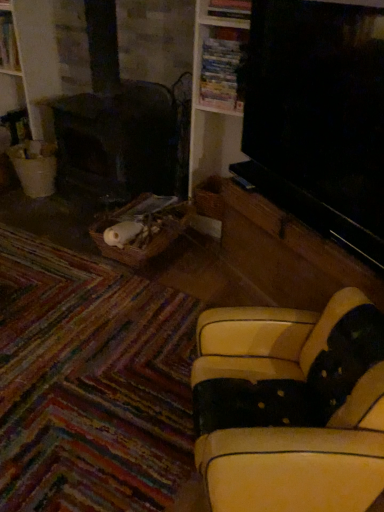
Find the location of `empty space that is ontop of wooden bookshelf at upper center (from a real-world perspective)`. empty space that is ontop of wooden bookshelf at upper center (from a real-world perspective) is located at coordinates tap(229, 32).